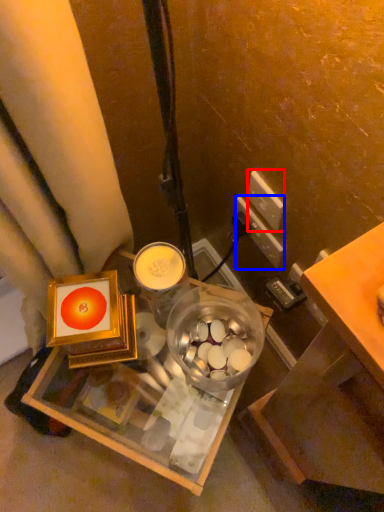
Question: Which of the following is the closest to the observer, power outlet (highlighted by a red box) or power outlet (highlighted by a blue box)?

Choices:
 (A) power outlet
 (B) power outlet

Answer: (A)